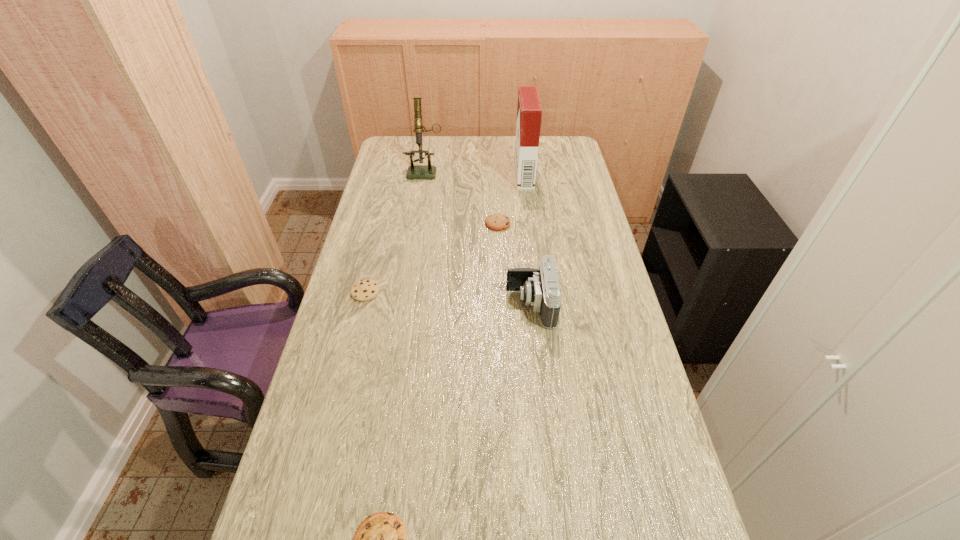
Locate an element on the screen. This screenshot has width=960, height=540. free point between the cigarette_case and the camera is located at coordinates (527, 240).

This screenshot has width=960, height=540. I want to click on empty space between the microscope and the fourth shortest object, so click(478, 238).

This screenshot has height=540, width=960. Find the location of `vacant area between the rightmost cookie and the leftmost cookie`. vacant area between the rightmost cookie and the leftmost cookie is located at coordinates coord(432,258).

The height and width of the screenshot is (540, 960). Find the location of `object that is the nearest to the microscope`. object that is the nearest to the microscope is located at coordinates (496, 222).

Locate which object ranks third in proximity to the fourth shortest object. Please provide its 2D coordinates. Your answer should be formatted as a tuple, i.e. [(x, y)], where the tuple contains the x and y coordinates of a point satisfying the conditions above.

[(529, 111)]

Select which cookie is the closest to the farthest cookie. Please provide its 2D coordinates. Your answer should be formatted as a tuple, i.e. [(x, y)], where the tuple contains the x and y coordinates of a point satisfying the conditions above.

[(364, 290)]

Identify the location of cookie that is the second closest to the farthest cookie. This screenshot has height=540, width=960. (381, 539).

Locate an element on the screen. The image size is (960, 540). vacant space that satisfies the following two spatial constraints: 1. at the eyepiece of the microscope; 2. on the right side of the third farthest object is located at coordinates (417, 224).

Find the location of a particular element. The height and width of the screenshot is (540, 960). free space that satisfies the following two spatial constraints: 1. at the eyepiece of the third farthest object; 2. on the left side of the microscope is located at coordinates pos(417,224).